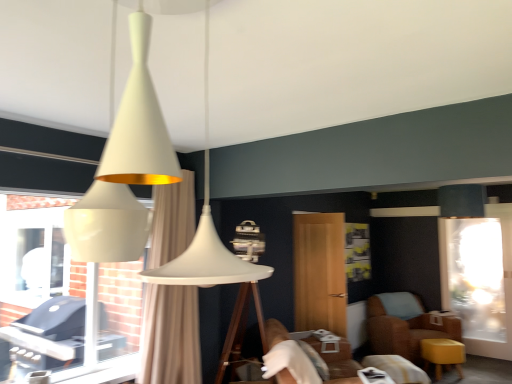
Identify the location of brown leather chair at lower right. The width and height of the screenshot is (512, 384). 405,325.

What do you see at coordinates (170, 335) in the screenshot? Image resolution: width=512 pixels, height=384 pixels. I see `beige fabric curtain at center` at bounding box center [170, 335].

I want to click on beige fabric curtain at center, so [170, 335].

I want to click on matte yellow stool at lower right, so coord(442,354).

Considering the positions of objects wooden screen door at center, the second screen door when ordered from right to left, and brown leather chair at lower right in the image provided, who is in front, wooden screen door at center, the second screen door when ordered from right to left, or brown leather chair at lower right?

Positioned in front is wooden screen door at center, the second screen door when ordered from right to left.

How distant is wooden screen door at center, which appears as the first screen door when viewed from the front, from brown leather chair at lower right?

wooden screen door at center, which appears as the first screen door when viewed from the front, is 3.29 feet away from brown leather chair at lower right.

Could brown leather chair at lower right be considered to be inside wooden screen door at center, which ranks as the first screen door in left-to-right order?

No.

Who is smaller, wooden screen door at center, the second screen door when ordered from right to left, or brown leather chair at lower right?

wooden screen door at center, the second screen door when ordered from right to left.

Is white glossy grill at left in contact with transparent glass screen door at right, the first screen door positioned from the back?

No, white glossy grill at left is not beside transparent glass screen door at right, the first screen door positioned from the back.

Is white glossy grill at left oriented towards transparent glass screen door at right, the first screen door positioned from the back?

No.

Measure the distance between white glossy grill at left and transparent glass screen door at right, the 2th screen door viewed from the front.

They are 4.64 meters apart.

Can you tell me how much white glossy grill at left and transparent glass screen door at right, the first screen door positioned from the back, differ in facing direction?

white glossy grill at left and transparent glass screen door at right, the first screen door positioned from the back, are facing 89.4 degrees away from each other.

From a real-world perspective, which object rests below the other?

transparent glass screen door at right, the 1th screen door in the right-to-left sequence, is physically lower.

Does point (173, 217) come in front of point (499, 253)?

Yes, point (173, 217) is closer to viewer.

Is beige fabric curtain at center in front of or behind transparent glass screen door at right, the first screen door positioned from the back, in the image?

beige fabric curtain at center is positioned closer to the viewer than transparent glass screen door at right, the first screen door positioned from the back.

Would you say beige fabric curtain at center is outside transparent glass screen door at right, the 2th screen door viewed from the front?

Yes.

Between brown leather chair at lower right and brown leather couch at lower center, which one has smaller size?

Smaller between the two is brown leather chair at lower right.

Which is closer to the camera, (390, 320) or (374, 361)?

Clearly, point (390, 320) is more distant from the camera than point (374, 361).

Can you tell me how much brown leather chair at lower right and brown leather couch at lower center differ in facing direction?

The facing directions of brown leather chair at lower right and brown leather couch at lower center are 80.2 degrees apart.

Could you tell me if brown leather chair at lower right is facing brown leather couch at lower center?

No.

What's the angular difference between wooden screen door at center, the 2th screen door from the back, and beige fabric curtain at center's facing directions?

96.2 degrees.

Is wooden screen door at center, which appears as the first screen door when viewed from the front, far away from beige fabric curtain at center?

Indeed, wooden screen door at center, which appears as the first screen door when viewed from the front, is not near beige fabric curtain at center.

Which is less distant, (316, 249) or (160, 339)?

Point (316, 249) appears to be farther away from the viewer than point (160, 339).

Does wooden screen door at center, which ranks as the first screen door in left-to-right order, have a lesser height compared to beige fabric curtain at center?

Correct, wooden screen door at center, which ranks as the first screen door in left-to-right order, is not as tall as beige fabric curtain at center.

Which of these two, satin black lampshade at upper right or beige fabric curtain at center, stands taller?

beige fabric curtain at center.

Are satin black lampshade at upper right and beige fabric curtain at center beside each other?

There is a gap between satin black lampshade at upper right and beige fabric curtain at center.

Is satin black lampshade at upper right wider or thinner than beige fabric curtain at center?

satin black lampshade at upper right is wider than beige fabric curtain at center.

Is point (511, 342) positioned behind point (483, 206)?

That is True.

Does transparent glass screen door at right, the first screen door positioned from the back, have a smaller size compared to satin black lampshade at upper right?

No.

Is transparent glass screen door at right, the 1th screen door in the right-to-left sequence, further to the viewer compared to satin black lampshade at upper right?

Yes, it is.

Does transparent glass screen door at right, the 1th screen door in the right-to-left sequence, have a lesser height compared to satin black lampshade at upper right?

Incorrect, the height of transparent glass screen door at right, the 1th screen door in the right-to-left sequence, does not fall short of that of satin black lampshade at upper right.

I want to click on screen door in front of the brown leather chair at lower right, so click(x=320, y=272).

Where is `bay window lying above the transparent glass screen door at right, the 1th screen door in the right-to-left sequence (from the image's perspective)`? The image size is (512, 384). bay window lying above the transparent glass screen door at right, the 1th screen door in the right-to-left sequence (from the image's perspective) is located at coordinates (58, 305).

Estimate the real-world distances between objects in this image. Which object is further from satin black lampshade at upper right, brown leather chair at lower right or matte yellow stool at lower right?

The object further to satin black lampshade at upper right is brown leather chair at lower right.

Considering their positions, is brown leather couch at lower center positioned closer to white glossy grill at left than beige fabric curtain at center?

beige fabric curtain at center lies closer to white glossy grill at left than the other object.

Estimate the real-world distances between objects in this image. Which object is closer to matte yellow stool at lower right, satin black lampshade at upper right or brown leather couch at lower center?

The object closer to matte yellow stool at lower right is brown leather couch at lower center.

Which object lies nearer to the anchor point transparent glass screen door at right, the first screen door positioned from the back, brown leather chair at lower right or wooden screen door at center, the second screen door when ordered from right to left?

The object closer to transparent glass screen door at right, the first screen door positioned from the back, is brown leather chair at lower right.

Estimate the real-world distances between objects in this image. Which object is further from wooden screen door at center, the 2th screen door from the back, beige fabric curtain at center or brown leather couch at lower center?

beige fabric curtain at center is positioned further to the anchor wooden screen door at center, the 2th screen door from the back.

Considering their positions, is satin black lampshade at upper right positioned further to brown leather couch at lower center than wooden screen door at center, which appears as the first screen door when viewed from the front?

Among the two, satin black lampshade at upper right is located further to brown leather couch at lower center.

When comparing their distances from transparent glass screen door at right, the 2th screen door viewed from the front, does brown leather couch at lower center or wooden screen door at center, which appears as the first screen door when viewed from the front, seem closer?

Based on the image, brown leather couch at lower center appears to be nearer to transparent glass screen door at right, the 2th screen door viewed from the front.

From the image, which object appears to be farther from brown leather chair at lower right, brown leather couch at lower center or satin black lampshade at upper right?

satin black lampshade at upper right.

Where is `bar stool located between brown leather chair at lower right and transparent glass screen door at right, the 1th screen door in the right-to-left sequence, in the left-right direction`? bar stool located between brown leather chair at lower right and transparent glass screen door at right, the 1th screen door in the right-to-left sequence, in the left-right direction is located at coordinates (442, 354).

You are a GUI agent. You are given a task and a screenshot of the screen. Output one action in this format:
    pyautogui.click(x=<x>, y=<y>)
    Task: Click on the furniture situated between white glossy grill at left and matte yellow stool at lower right from left to right
    Image resolution: width=512 pixels, height=384 pixels.
    Given the screenshot: What is the action you would take?
    pyautogui.click(x=365, y=365)

At what (x,y) coordinates should I click in order to perform the action: click on chair situated between white glossy grill at left and transparent glass screen door at right, placed as the 2th screen door when sorted from left to right, from left to right. Please return your answer as a coordinate pair (x, y). The height and width of the screenshot is (384, 512). Looking at the image, I should click on (405, 325).

The height and width of the screenshot is (384, 512). I want to click on furniture between beige fabric curtain at center and wooden screen door at center, which appears as the first screen door when viewed from the front, along the z-axis, so (x=365, y=365).